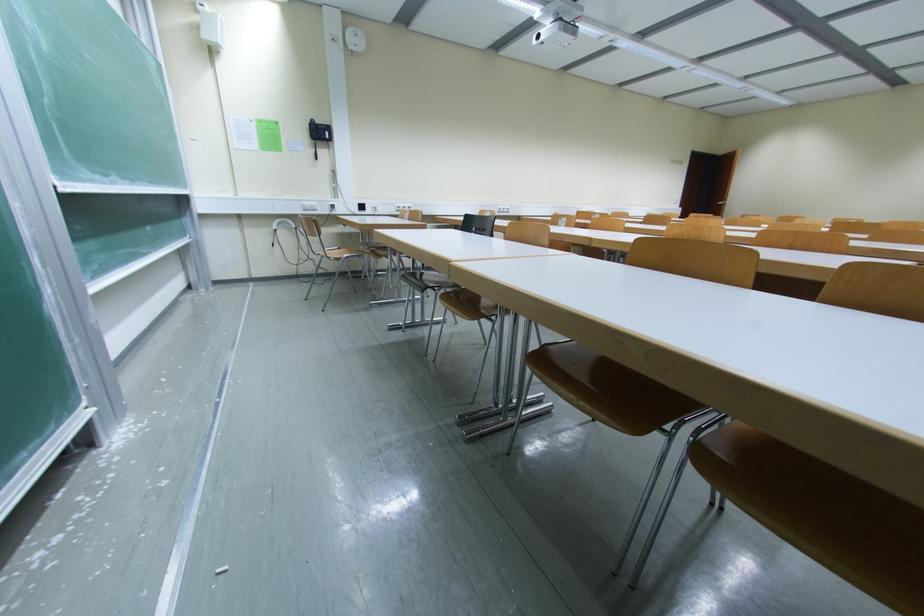
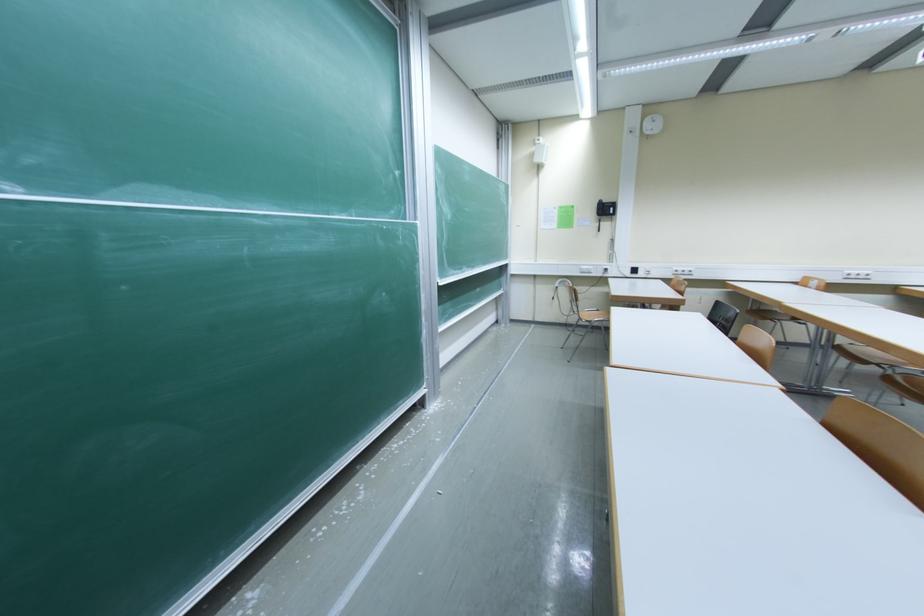
Question: The camera is either moving clockwise (left) or counter-clockwise (right) around the object. The first image is from the beginning of the video and the second image is from the end. Is the camera moving left or right when shooting the video?

Choices:
 (A) Left
 (B) Right

Answer: (B)